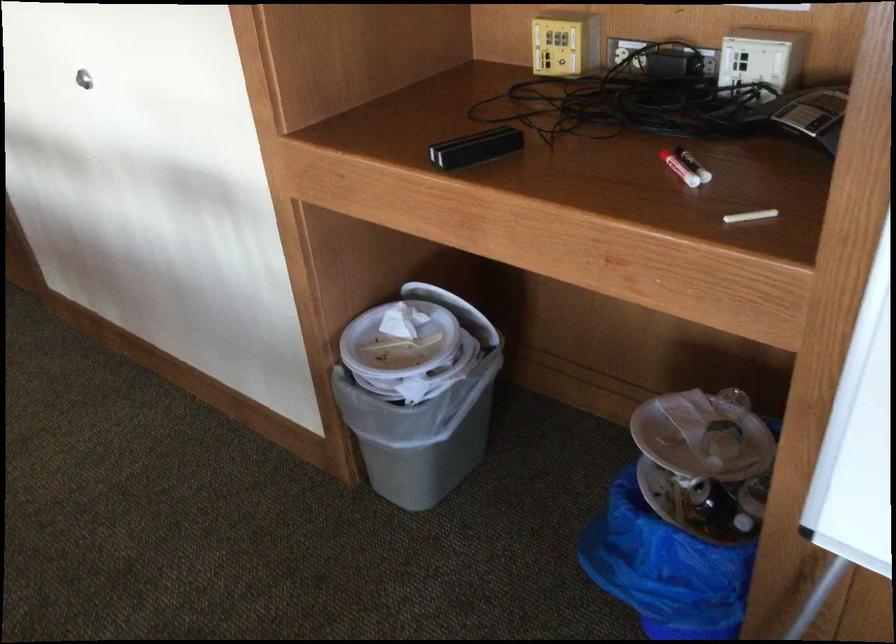
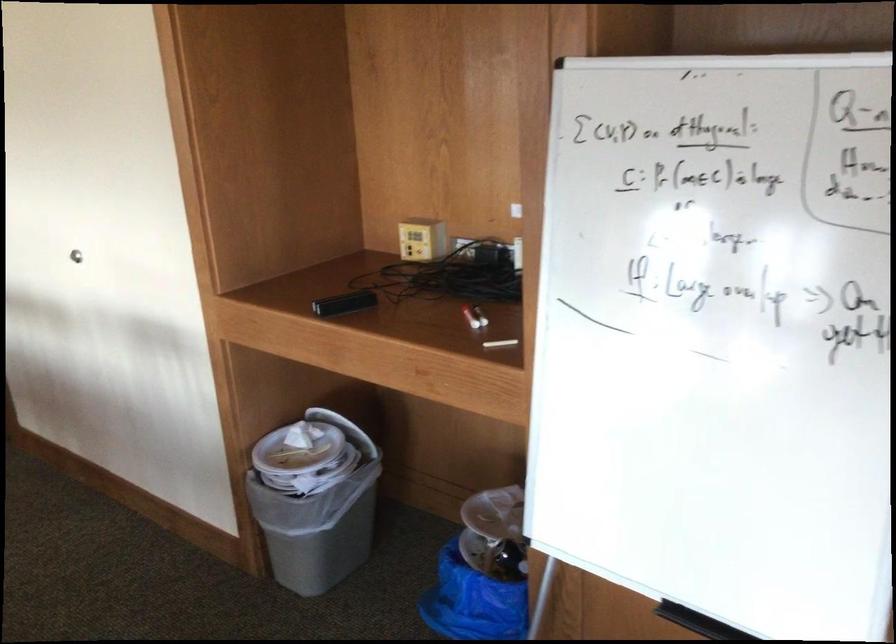
Find the pixel in the second image that matches (400,335) in the first image.

(297, 448)